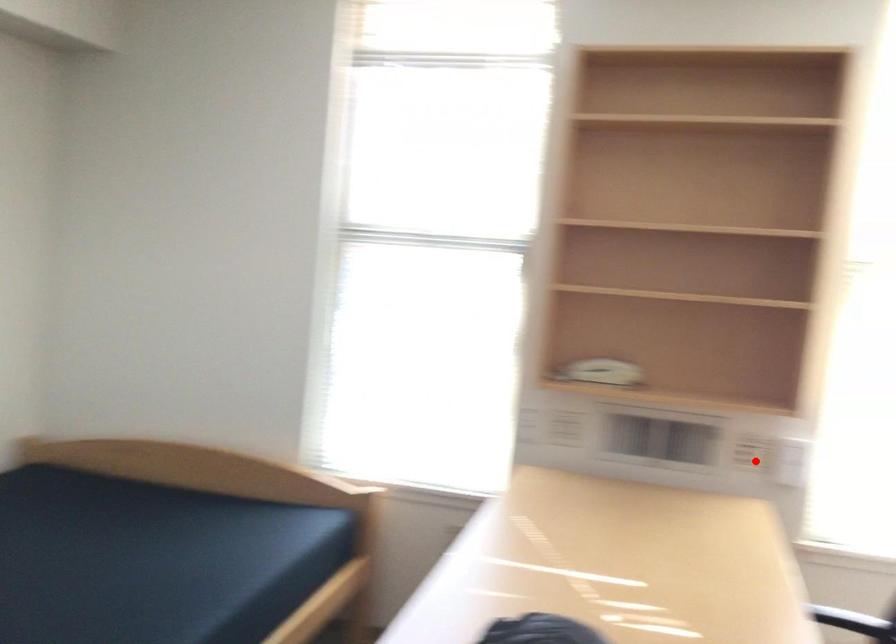
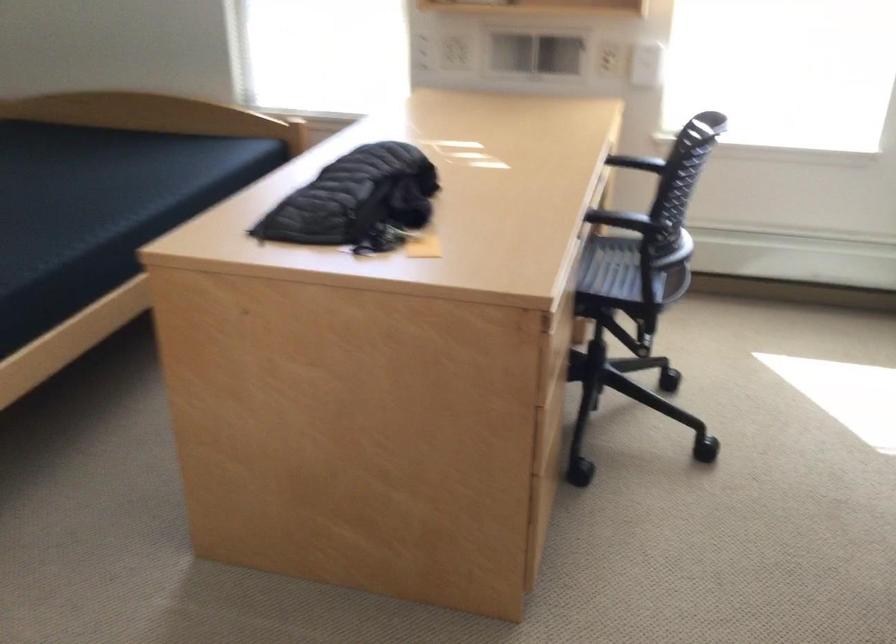
Question: I am providing you with two images of the same scene from different viewpoints. A red point is marked on the first image. Is the red point's position out of view in image 2?

Choices:
 (A) Yes
 (B) No

Answer: (B)